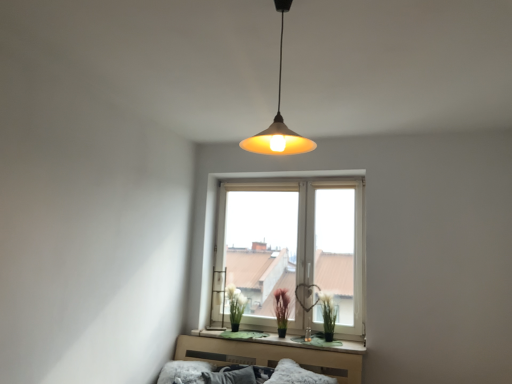
Find the location of a particular element. white plastic window at center is located at coordinates (290, 249).

What are the coordinates of `green matte plant at window, positioned as the 1th plant in right-to-left order` in the screenshot? It's located at (328, 315).

This screenshot has height=384, width=512. I want to click on white plastic window at center, so click(290, 249).

Looking at this image, from their relative heights in the image, would you say matte yellow plastic lampshade at upper center is taller or shorter than white plastic window at center?

Clearly, matte yellow plastic lampshade at upper center is shorter compared to white plastic window at center.

Could you tell me if matte yellow plastic lampshade at upper center is facing white plastic window at center?

No, matte yellow plastic lampshade at upper center is not turned towards white plastic window at center.

This screenshot has height=384, width=512. Find the location of `window on the right side of matte yellow plastic lampshade at upper center`. window on the right side of matte yellow plastic lampshade at upper center is located at coordinates (290, 249).

Is matte yellow plastic lampshade at upper center inside the boundaries of white plastic window at center, or outside?

matte yellow plastic lampshade at upper center is outside white plastic window at center.

Which is more to the left, white plastic window at center or matte yellow plastic lampshade at upper center?

From the viewer's perspective, matte yellow plastic lampshade at upper center appears more on the left side.

Is white plastic window at center taller or shorter than matte yellow plastic lampshade at upper center?

Clearly, white plastic window at center is taller compared to matte yellow plastic lampshade at upper center.

From the image's perspective, is white plastic window at center positioned above or below matte yellow plastic lampshade at upper center?

white plastic window at center is below matte yellow plastic lampshade at upper center.

Would you consider white plastic window at center to be distant from matte yellow plastic lampshade at upper center?

That's right, there is a large distance between white plastic window at center and matte yellow plastic lampshade at upper center.

In the scene shown: Is purple matte plant at center, placed as the second plant when sorted from right to left, directly adjacent to green matte plant at window, positioned as the 1th plant in right-to-left order?

No, purple matte plant at center, placed as the second plant when sorted from right to left, is not next to green matte plant at window, positioned as the 1th plant in right-to-left order.

Is purple matte plant at center, arranged as the first plant when viewed from the left, outside of green matte plant at window, positioned as the 1th plant in right-to-left order?

purple matte plant at center, arranged as the first plant when viewed from the left, is positioned outside green matte plant at window, positioned as the 1th plant in right-to-left order.

Is purple matte plant at center, arranged as the first plant when viewed from the left, oriented towards green matte plant at window, which is the 2th plant in left-to-right order?

No, purple matte plant at center, arranged as the first plant when viewed from the left, is not facing towards green matte plant at window, which is the 2th plant in left-to-right order.

Considering the sizes of objects purple matte plant at center, arranged as the first plant when viewed from the left, and green matte plant at window, which is the 2th plant in left-to-right order, in the image provided, who is taller, purple matte plant at center, arranged as the first plant when viewed from the left, or green matte plant at window, which is the 2th plant in left-to-right order,?

With more height is purple matte plant at center, arranged as the first plant when viewed from the left.

Image resolution: width=512 pixels, height=384 pixels. What are the coordinates of `flower positioned vertically above the fluffy white pillow at lower center, the 1th pillow from the left (from a real-world perspective)` in the screenshot? It's located at (236, 303).

Is fluffy white pillow at lower center, the 1th pillow from the left, positioned with its back to white matte plant at center?

No, fluffy white pillow at lower center, the 1th pillow from the left,'s orientation is not away from white matte plant at center.

How different are the orientations of fluffy white pillow at lower center, the 1th pillow from the left, and white matte plant at center in degrees?

1.25 degrees separate the facing orientations of fluffy white pillow at lower center, the 1th pillow from the left, and white matte plant at center.

Can you confirm if fluffy white pillow at lower center, the second pillow when ordered from right to left, is positioned to the left of white matte plant at center?

Yes, fluffy white pillow at lower center, the second pillow when ordered from right to left, is to the left of white matte plant at center.

How distant is green matte window sill at center from fluffy white pillow at lower center, the 1th pillow from the left?

green matte window sill at center and fluffy white pillow at lower center, the 1th pillow from the left, are 22.24 inches apart.

Which point is more forward, (200,332) or (196,366)?

The point (196,366) is closer to the camera.

At what (x,y) coordinates should I click in order to perform the action: click on pillow that is on the left side of green matte window sill at center. Please return your answer as a coordinate pair (x, y). Looking at the image, I should click on (184, 372).

Is green matte window sill at center to the left or to the right of fluffy white pillow at lower center, the second pillow when ordered from right to left, in the image?

From the image, it's evident that green matte window sill at center is to the right of fluffy white pillow at lower center, the second pillow when ordered from right to left.

Is green matte plant at window, which is the 2th plant in left-to-right order, touching white matte plant at center?

No, green matte plant at window, which is the 2th plant in left-to-right order, is not in contact with white matte plant at center.

Identify the location of flower above the green matte plant at window, positioned as the 1th plant in right-to-left order (from the image's perspective). (236, 303).

Is green matte plant at window, positioned as the 1th plant in right-to-left order, aimed at white matte plant at center?

No, green matte plant at window, positioned as the 1th plant in right-to-left order, is not turned towards white matte plant at center.

From the image's perspective, is green matte plant at window, which is the 2th plant in left-to-right order, positioned above or below white matte plant at center?

Clearly, from the image's perspective, green matte plant at window, which is the 2th plant in left-to-right order, is below white matte plant at center.

Who is smaller, white fluffy pillow at lower center, the 1th pillow from the right, or purple matte plant at center, arranged as the first plant when viewed from the left?

purple matte plant at center, arranged as the first plant when viewed from the left, is smaller.

From a real-world perspective, starting from the purple matte plant at center, arranged as the first plant when viewed from the left, which pillow is the 1st one below it? Please provide its 2D coordinates.

[(296, 375)]

Is white fluffy pillow at lower center, the 1th pillow from the right, closer to the viewer compared to purple matte plant at center, arranged as the first plant when viewed from the left?

Yes, white fluffy pillow at lower center, the 1th pillow from the right, is closer to the camera.

What are the coordinates of `window below the matte yellow plastic lampshade at upper center (from a real-world perspective)` in the screenshot? It's located at (290, 249).

At what (x,y) coordinates should I click in order to perform the action: click on lamp in front of the white plastic window at center. Please return your answer as a coordinate pair (x, y). This screenshot has width=512, height=384. Looking at the image, I should click on (278, 118).

From the image, which object appears to be farther from white matte plant at center, fluffy white pillow at lower center, the 1th pillow from the left, or green matte plant at window, positioned as the 1th plant in right-to-left order?

green matte plant at window, positioned as the 1th plant in right-to-left order, lies further to white matte plant at center than the other object.

When comparing their distances from white matte plant at center, does white plastic window at center or white fluffy pillow at lower center, which is the 2th pillow from left to right, seem closer?

The object closer to white matte plant at center is white plastic window at center.

When comparing their distances from purple matte plant at center, arranged as the first plant when viewed from the left, does white matte plant at center or green matte plant at window, which is the 2th plant in left-to-right order, seem further?

white matte plant at center.

When comparing their distances from white plastic window at center, does green matte window sill at center or fluffy white pillow at lower center, the second pillow when ordered from right to left, seem closer?

green matte window sill at center is closer to white plastic window at center.

Based on their spatial positions, is fluffy white pillow at lower center, the 1th pillow from the left, or green matte window sill at center further from green matte plant at window, positioned as the 1th plant in right-to-left order?

fluffy white pillow at lower center, the 1th pillow from the left, lies further to green matte plant at window, positioned as the 1th plant in right-to-left order, than the other object.

When comparing their distances from white plastic window at center, does white matte plant at center or fluffy white pillow at lower center, the second pillow when ordered from right to left, seem further?

fluffy white pillow at lower center, the second pillow when ordered from right to left, lies further to white plastic window at center than the other object.

From the image, which object appears to be farther from white fluffy pillow at lower center, which is the 2th pillow from left to right, purple matte plant at center, arranged as the first plant when viewed from the left, or green matte window sill at center?

purple matte plant at center, arranged as the first plant when viewed from the left, is further to white fluffy pillow at lower center, which is the 2th pillow from left to right.

Estimate the real-world distances between objects in this image. Which object is closer to fluffy white pillow at lower center, the second pillow when ordered from right to left, white plastic window at center or green matte window sill at center?

green matte window sill at center is positioned closer to the anchor fluffy white pillow at lower center, the second pillow when ordered from right to left.

Identify the location of window between white matte plant at center and green matte plant at window, which is the 2th plant in left-to-right order. The height and width of the screenshot is (384, 512). (290, 249).

Identify the location of window between fluffy white pillow at lower center, the second pillow when ordered from right to left, and green matte plant at window, positioned as the 1th plant in right-to-left order, from left to right. (290, 249).

Locate an element on the screen. Image resolution: width=512 pixels, height=384 pixels. window sill between fluffy white pillow at lower center, the second pillow when ordered from right to left, and purple matte plant at center, arranged as the first plant when viewed from the left, from left to right is located at coordinates (282, 340).

Find the location of a particular element. The image size is (512, 384). window sill between white fluffy pillow at lower center, which is the 2th pillow from left to right, and green matte plant at window, which is the 2th plant in left-to-right order, in the front-back direction is located at coordinates (282, 340).